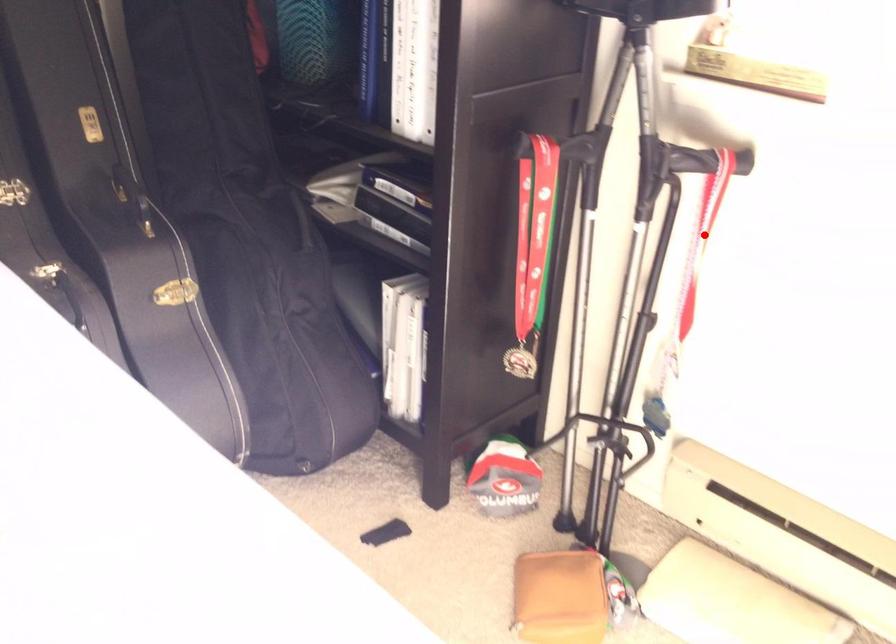
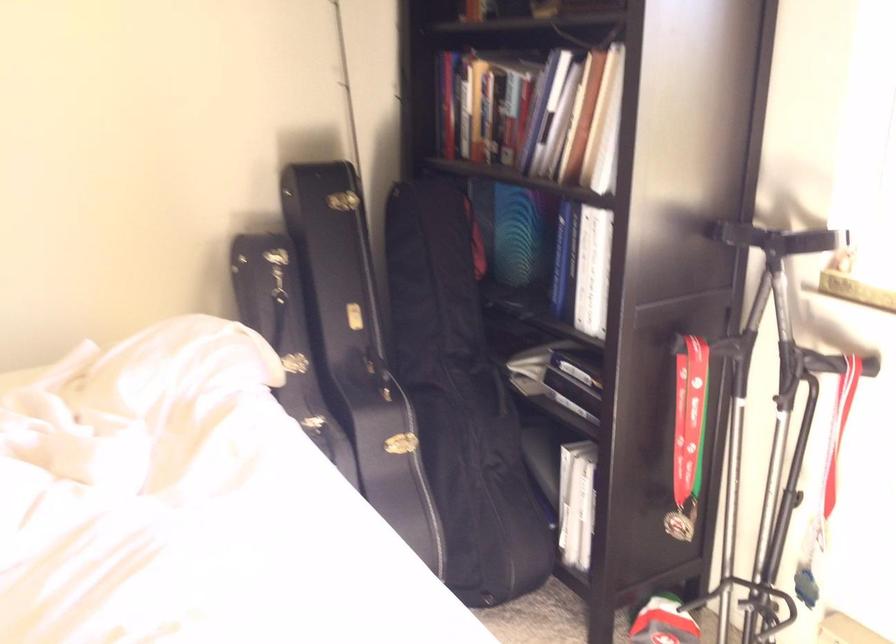
Find the pixel in the second image that matches the highlighted location in the first image.

(839, 429)